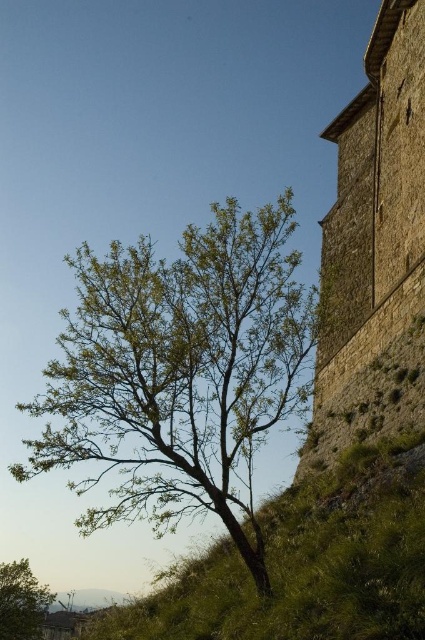
You are a gardener planning to plant a new flower bed between the green grassy at lower right and the green leafy tree at lower left. Which area has more space available for planting?

The green grassy at lower right might be wider than the green leafy tree at lower left, so it likely has more space available for planting.

You are standing in the middle of the grassy slope and see the green leafy tree at center and the brown stone tower at right. Which object is higher up in the slope?

The brown stone tower at right is higher up on the slope than the green leafy tree at center because the green leafy tree at center is positioned below it.

You are an artist planning to paint the scene. You want to ensure the green leafy tree at center and the green leafy tree at lower left are proportionally accurate. Which tree should you draw wider in your painting?

The green leafy tree at center should be drawn wider because its width is larger than the green leafy tree at lower left.